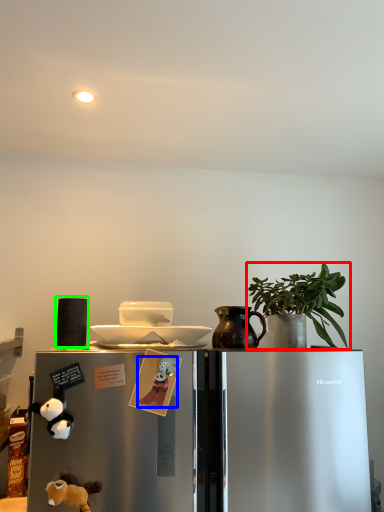
Question: Which is farther away from houseplant (highlighted by a red box)? animal (highlighted by a blue box) or appliance (highlighted by a green box)?

Choices:
 (A) animal
 (B) appliance

Answer: (B)